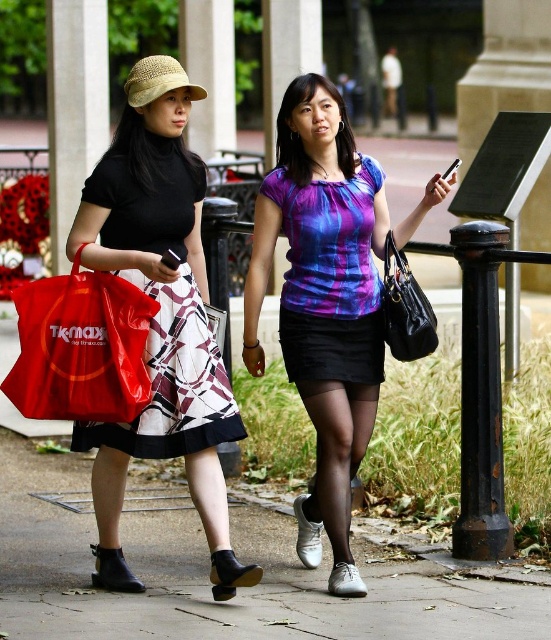
You are a photographer standing at the center of the pathway. You want to take a photo of the red plastic bag at left and the straw hat at upper left. Which object is closer to your camera lens?

The red plastic bag at left is closer to the camera lens because it is 5.18 feet away from the straw hat at upper left, which would mean the red plastic bag is nearer than the straw hat.

From the picture: You are a photographer trying to capture a candid shot of the two people in the scene. You want to ensure that both the shiny purple fabric dress at center and the black leather handbag at right are clearly visible in the frame. Based on their positions and sizes, do you think you can fit both into your camera viewfinder without zooming in or out?

The shiny purple fabric dress at center might be wider than black leather handbag at right, so there is a possibility that the dress could take up more space in the frame. However, since both are positioned at center and right respectively, you should be able to include both in the viewfinder without zooming, provided the camera has a wide enough angle to accommodate their relative sizes and positions.